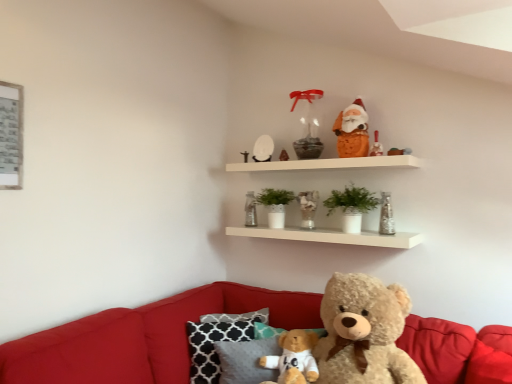
Question: From the image's perspective, relative to translucent glass candle at upper center, is velvet red couch at lower center above or below?

Choices:
 (A) above
 (B) below

Answer: (B)

Question: Relative to translucent glass candle at upper center, is velvet red couch at lower center in front or behind?

Choices:
 (A) front
 (B) behind

Answer: (A)

Question: Which object is positioned farthest from the translucent glass candle at upper center, the second toy viewed from the right?

Choices:
 (A) orange plush santa at upper center
 (B) green matte plant at center, acting as the 1th plant starting from the left
 (C) translucent glass candle at upper center
 (D) clear glass vase at upper center, the 7th toy positioned from the left
 (E) velvet red couch at lower center

Answer: (E)

Question: Which of these objects is positioned closest to the velvet red couch at lower center?

Choices:
 (A) matte white candle at upper center, which is counted as the fourth toy, starting from the left
 (B) metallic silver picture frame at upper left
 (C) metallic silver vase at upper center, which appears as the 2th toy when viewed from the left
 (D) translucent glass candle at upper center, marked as the 6th toy in a left-to-right arrangement
 (E) orange plush santa at upper center

Answer: (B)